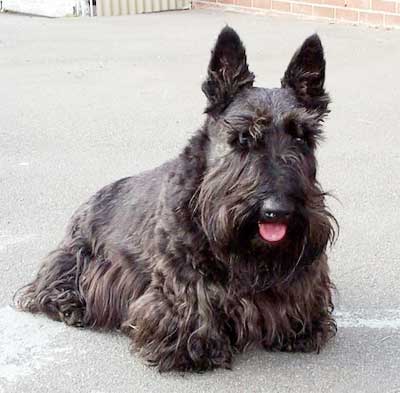
Find the location of a particular element. brick wall is located at coordinates (332, 9).